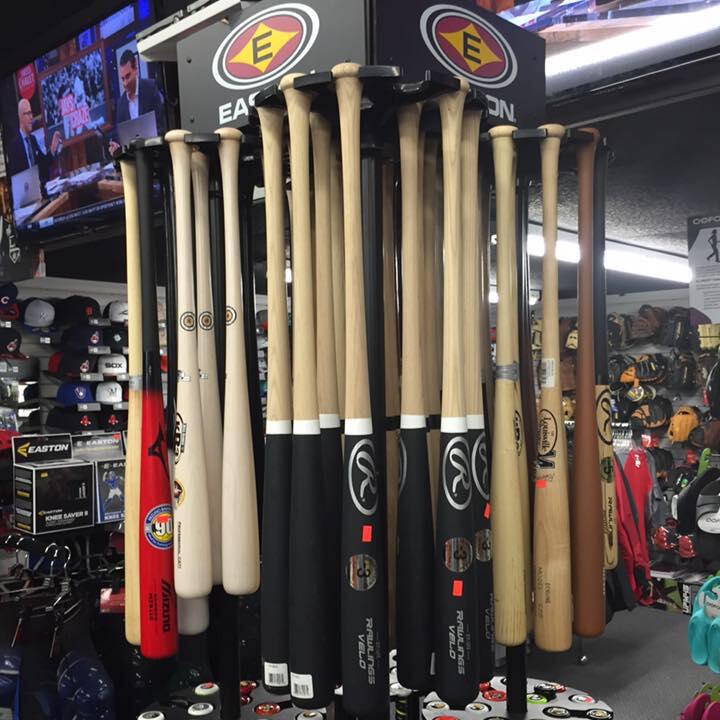
What are the coordinates of `grey floor` in the screenshot? It's located at (644, 667).